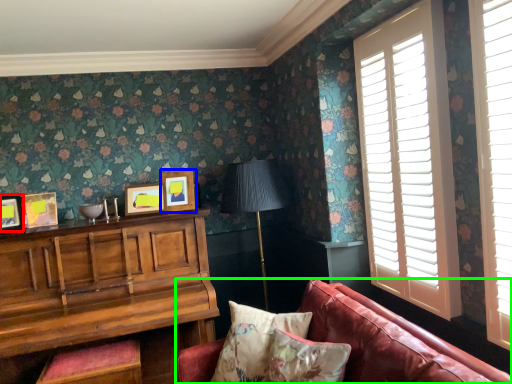
Question: Based on their relative distances, which object is nearer to picture frame (highlighted by a red box)? Choose from picture frame (highlighted by a blue box) and studio couch (highlighted by a green box).

Choices:
 (A) picture frame
 (B) studio couch

Answer: (A)